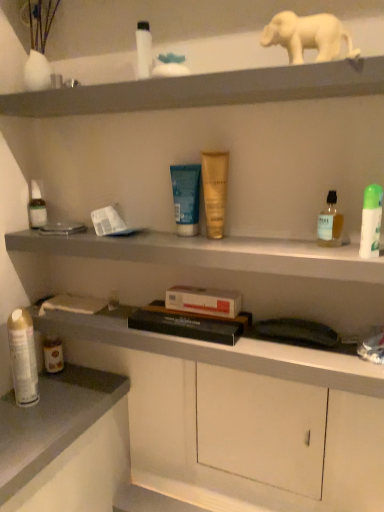
Find the location of `vacant area situated to the left side of hardcover book at center`. vacant area situated to the left side of hardcover book at center is located at coordinates (111, 317).